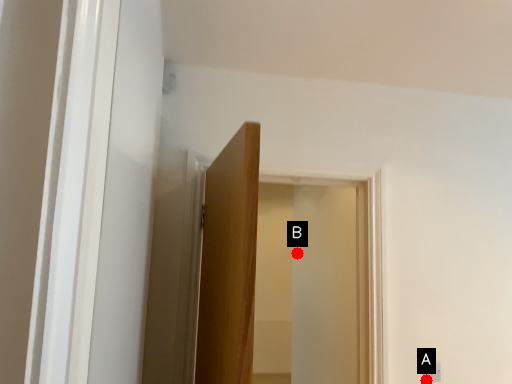
Question: Two points are circled on the image, labeled by A and B beside each circle. Which point is farther to the camera?

Choices:
 (A) A is further
 (B) B is further

Answer: (B)